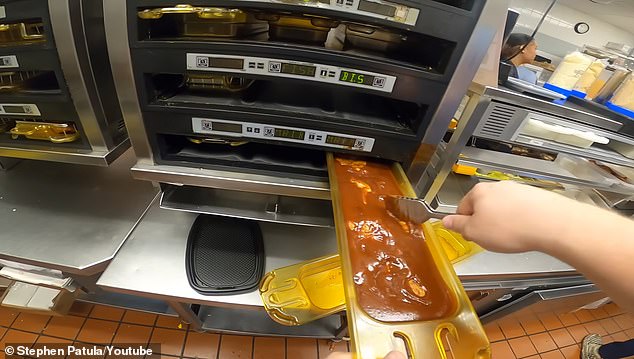
Identify the location of bottom drawer. This screenshot has height=359, width=634. (522, 298).